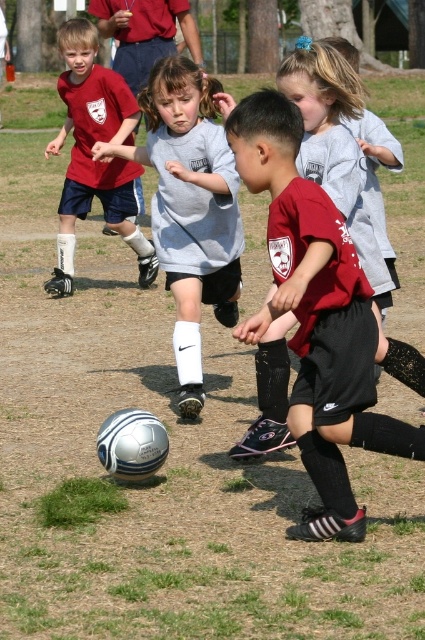
You are a soccer coach observing the game. The field has a goal at the bottom edge. Where should you direct the children to aim the white matte soccer ball at center to score a goal?

The white matte soccer ball at center is located at point (189, 209), so to score a goal, the children should aim towards the bottom edge of the field where the goal is positioned.

You are a soccer coach observing the game. You notice the matte red shirt at left and the gray cotton shirt at upper center. Which player is positioned further to the left side of the field?

The matte red shirt at left is positioned further to the left side of the field compared to the gray cotton shirt at upper center.

Based on the photo, you are a photographer trying to capture a photo of the soccer game. You want to ensure both the matte red shirt at center and the white matte soccer ball at center are clearly visible in your shot. Based on their positions, which object is positioned to the right side of the other?

The matte red shirt at center is positioned to the right of the white matte soccer ball at center.